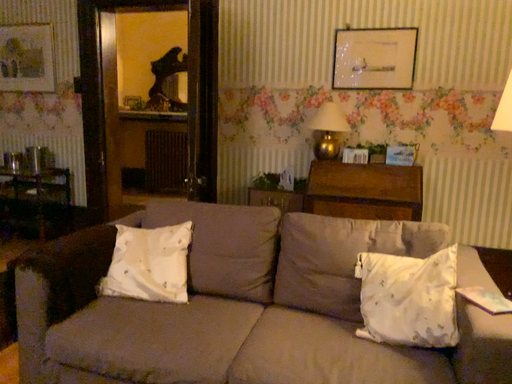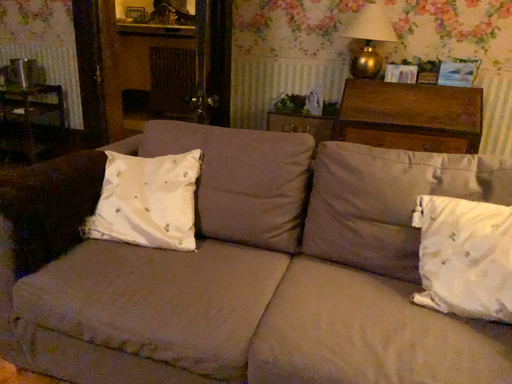
Question: How did the camera likely rotate when shooting the video?

Choices:
 (A) rotated upward
 (B) rotated downward

Answer: (B)